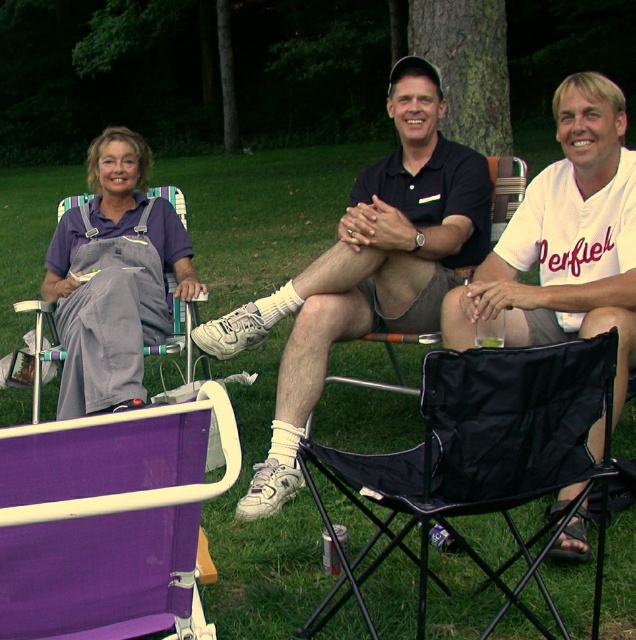
Question: Can you confirm if black fabric folding chair at center is positioned above white jersey at center?

Choices:
 (A) no
 (B) yes

Answer: (A)

Question: Is matte black polo shirt at center wider than white jersey at center?

Choices:
 (A) no
 (B) yes

Answer: (B)

Question: Which of these objects is positioned closest to the matte black polo shirt at center?

Choices:
 (A) black fabric folding chair at center
 (B) matte purple shirt at left

Answer: (B)

Question: Which point appears farthest from the camera in this image?

Choices:
 (A) (612, 253)
 (B) (436, 221)

Answer: (B)

Question: Is matte purple shirt at left to the right of black fabric chair at center from the viewer's perspective?

Choices:
 (A) no
 (B) yes

Answer: (A)

Question: Among these points, which one is farthest from the camera?

Choices:
 (A) (401, 376)
 (B) (59, 442)
 (C) (630, 321)
 (D) (427, 296)

Answer: (A)